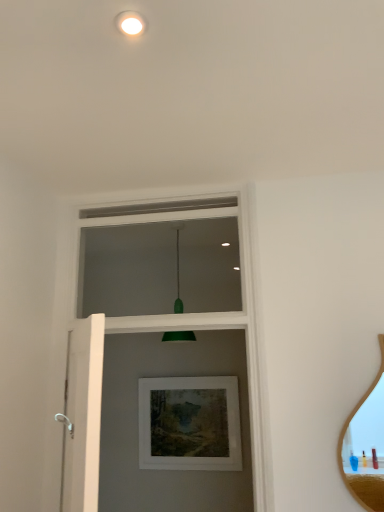
Question: Is white matte screen door at left taller or shorter than matte white picture frame at center?

Choices:
 (A) short
 (B) tall

Answer: (B)

Question: Does point (97, 348) appear closer or farther from the camera than point (168, 445)?

Choices:
 (A) farther
 (B) closer

Answer: (B)

Question: Which is nearer to the white painted wood at upper center?

Choices:
 (A) wooden mirror at right
 (B) matte white picture frame at center
 (C) white matte screen door at left
 (D) green matte droplight at upper center

Answer: (C)

Question: Which object is the closest to the white matte screen door at left?

Choices:
 (A) matte white picture frame at center
 (B) white painted wood at upper center
 (C) green matte droplight at upper center
 (D) wooden mirror at right

Answer: (B)